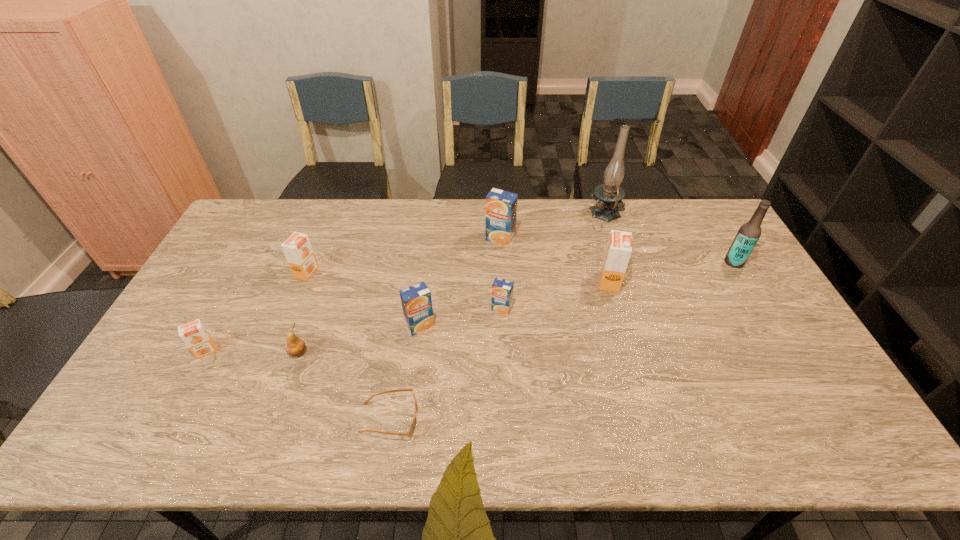
I want to click on vacant region located on the front-facing side of the nearest object, so click(480, 419).

In order to click on oil lamp at the far edge in this screenshot , I will do `click(610, 195)`.

Find the location of a particular element. orange_juice at the far edge is located at coordinates (501, 206).

Where is `object at the near edge`? The image size is (960, 540). object at the near edge is located at coordinates pos(411,430).

You are a GUI agent. You are given a task and a screenshot of the screen. Output one action in this format:
    pyautogui.click(x=<x>, y=<y>)
    Task: Click on the object present at the left edge
    Image resolution: width=960 pixels, height=540 pixels.
    Given the screenshot: What is the action you would take?
    pyautogui.click(x=194, y=334)

Locate an element on the screen. object that is positioned at the right edge is located at coordinates pyautogui.click(x=749, y=233).

At what (x,y) coordinates should I click in order to perform the action: click on vacant space at the far edge. Please return your answer as a coordinate pair (x, y). The width and height of the screenshot is (960, 540). Looking at the image, I should click on (544, 210).

You are a GUI agent. You are given a task and a screenshot of the screen. Output one action in this format:
    pyautogui.click(x=<x>, y=<y>)
    Task: Click on the blank space at the near edge of the desktop
    Image resolution: width=960 pixels, height=540 pixels.
    Given the screenshot: What is the action you would take?
    pyautogui.click(x=310, y=419)

In the image, there is a desktop. Where is `free space at the left edge`? The height and width of the screenshot is (540, 960). free space at the left edge is located at coordinates (196, 313).

Locate an element on the screen. free location at the right edge of the desktop is located at coordinates (762, 389).